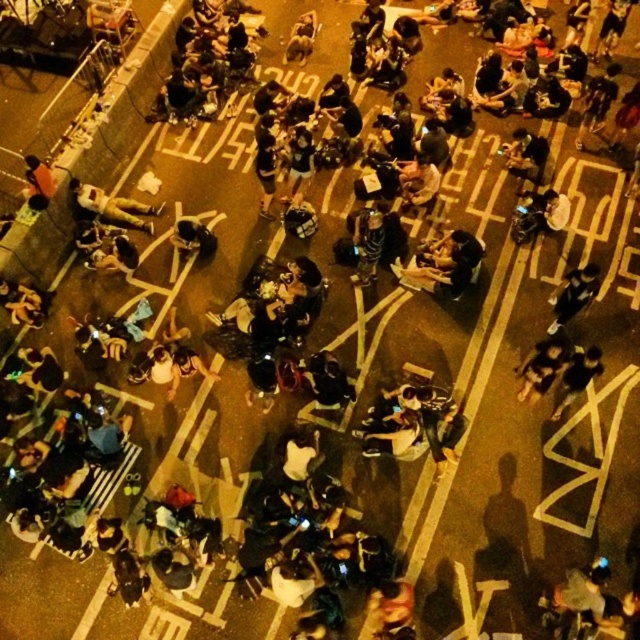
Question: Does dark gray fabric body at lower left appear under matte black shirt at lower left?

Choices:
 (A) no
 (B) yes

Answer: (B)

Question: Where is dark gray fabric body at lower left located in relation to matte black shirt at lower left in the image?

Choices:
 (A) below
 (B) above

Answer: (A)

Question: Can you confirm if dark gray fabric body at lower left is positioned below matte black shirt at lower left?

Choices:
 (A) yes
 (B) no

Answer: (A)

Question: Among these points, which one is farthest from the camera?

Choices:
 (A) (86, 209)
 (B) (26, 161)

Answer: (A)

Question: Which of the following is the closest to the observer?

Choices:
 (A) matte black shirt at lower left
 (B) dark gray fabric body at lower left

Answer: (A)